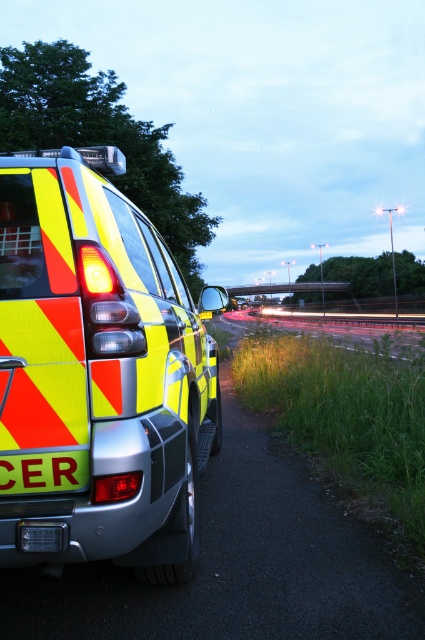
Between metallic asphalt highway at center and yellow reflective sign at lower left, which one is positioned lower?

yellow reflective sign at lower left is lower down.

I want to click on metallic asphalt highway at center, so click(342, 328).

Find the location of a particular element. metallic asphalt highway at center is located at coordinates (342, 328).

Is reflective plastic ambulance at center-left further to the viewer compared to yellow reflective sign at lower left?

That is False.

Between reflective plastic ambulance at center-left and yellow reflective sign at lower left, which one appears on the right side from the viewer's perspective?

reflective plastic ambulance at center-left is more to the right.

Is point (207, 353) positioned behind point (0, 461)?

Yes, point (207, 353) is behind point (0, 461).

This screenshot has width=425, height=640. What are the coordinates of `reflective plastic ambulance at center-left` in the screenshot? It's located at (101, 369).

Can you confirm if reflective plastic ambulance at center-left is bigger than metallic asphalt highway at center?

Actually, reflective plastic ambulance at center-left might be smaller than metallic asphalt highway at center.

Does reflective plastic ambulance at center-left appear on the right side of metallic asphalt highway at center?

No, reflective plastic ambulance at center-left is not to the right of metallic asphalt highway at center.

The height and width of the screenshot is (640, 425). Describe the element at coordinates (101, 369) in the screenshot. I see `reflective plastic ambulance at center-left` at that location.

At what (x,y) coordinates should I click in order to perform the action: click on reflective plastic ambulance at center-left. Please return your answer as a coordinate pair (x, y). The width and height of the screenshot is (425, 640). Looking at the image, I should click on (101, 369).